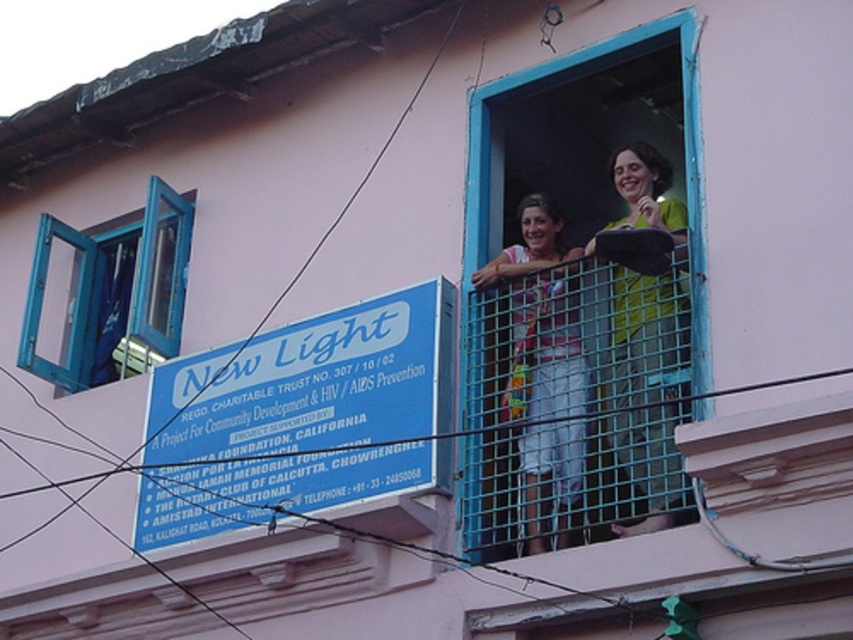
Question: Is blue metal fence at center closer to the viewer compared to green fabric dress at center?

Choices:
 (A) yes
 (B) no

Answer: (B)

Question: Which point is farther from the camera taking this photo?

Choices:
 (A) (56, 237)
 (B) (195, 385)
 (C) (633, 413)
 (D) (550, 273)

Answer: (A)

Question: Among these objects, which one is farthest from the camera?

Choices:
 (A) matte pink blouse at center
 (B) blue plastic sign at lower left
 (C) blue painted wood window at left

Answer: (C)

Question: Can you confirm if blue plastic sign at lower left is thinner than blue painted wood window at left?

Choices:
 (A) no
 (B) yes

Answer: (A)

Question: Observing the image, what is the correct spatial positioning of blue metal fence at center in reference to matte pink blouse at center?

Choices:
 (A) right
 (B) left

Answer: (B)

Question: Based on their relative distances, which object is farther from the blue plastic sign at lower left?

Choices:
 (A) blue metal fence at center
 (B) matte pink blouse at center
 (C) green fabric dress at center
 (D) blue painted wood window at left

Answer: (D)